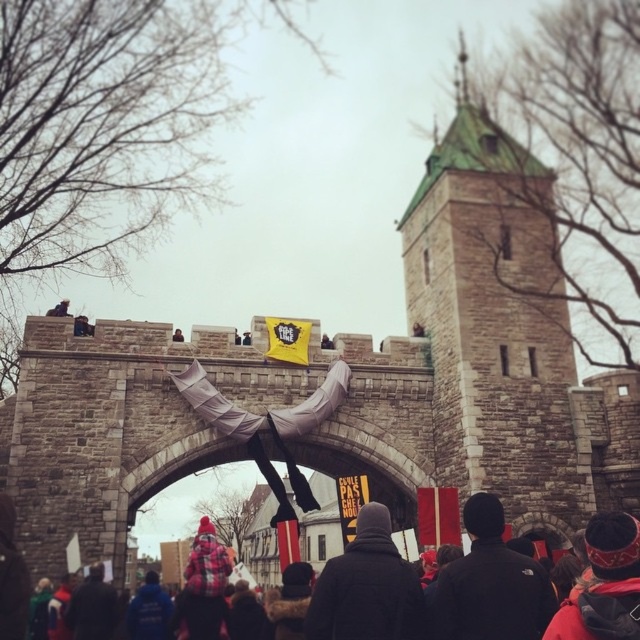
Locate an element on the screen. This screenshot has width=640, height=640. black woolen hat at center is located at coordinates (368, 588).

Between point (410, 634) and point (74, 632), which one is positioned behind?

The point (74, 632) is behind.

Locate an element on the screen. black woolen hat at center is located at coordinates (368, 588).

Is point (512, 605) farther from camera compared to point (74, 600)?

That is False.

Looking at this image, between red knit hat at center and dark blue jacket at lower left, which one appears on the left side from the viewer's perspective?

From the viewer's perspective, dark blue jacket at lower left appears more on the left side.

Which is behind, point (621, 532) or point (77, 618)?

The point (77, 618) is behind.

The image size is (640, 640). Identify the location of red knit hat at center. (589, 588).

Does black matte jacket at center have a lesser width compared to black woolen hat at center?

No, black matte jacket at center is not thinner than black woolen hat at center.

Which is above, black matte jacket at center or black woolen hat at center?

black matte jacket at center is higher up.

What do you see at coordinates (490, 584) in the screenshot? I see `black matte jacket at center` at bounding box center [490, 584].

Identify the location of black matte jacket at center. (490, 584).